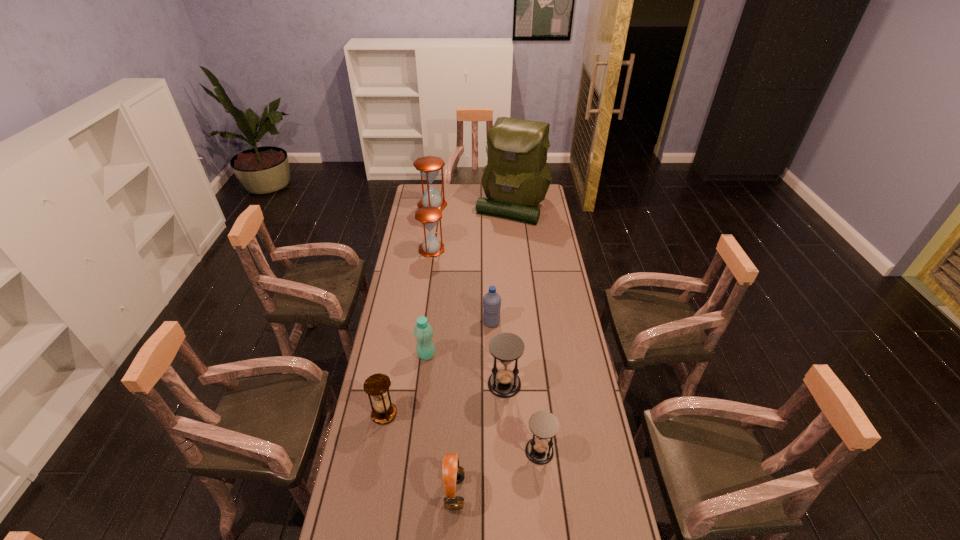
Where is `bottle`? This screenshot has width=960, height=540. bottle is located at coordinates (423, 332).

Identify the location of the nearest brown hourglass. The image size is (960, 540). (377, 386).

At what (x,y) coordinates should I click in order to perform the action: click on the second nearest hourglass. Please return your answer as a coordinate pair (x, y). This screenshot has width=960, height=540. Looking at the image, I should click on (377, 386).

Locate an element on the screen. headset is located at coordinates (453, 473).

Where is `the nearest object`? The image size is (960, 540). the nearest object is located at coordinates (453, 473).

At what (x,y) coordinates should I click in order to perform the action: click on the smaller black hourglass. Please return your answer as a coordinate pair (x, y). The width and height of the screenshot is (960, 540). Looking at the image, I should click on (544, 425).

Find the location of `the nearest hourglass`. the nearest hourglass is located at coordinates (544, 425).

The height and width of the screenshot is (540, 960). In order to click on vacant space located 0.380m on the front of the backpack with visible pockets in this screenshot , I will do `click(518, 271)`.

At what (x,y) coordinates should I click in order to perform the action: click on vacant space located on the front of the tallest hourglass. Please return your answer as a coordinate pair (x, y). This screenshot has height=540, width=960. Looking at the image, I should click on (427, 240).

Locate an element on the screen. vacant region located on the front of the fourth nearest hourglass is located at coordinates (427, 280).